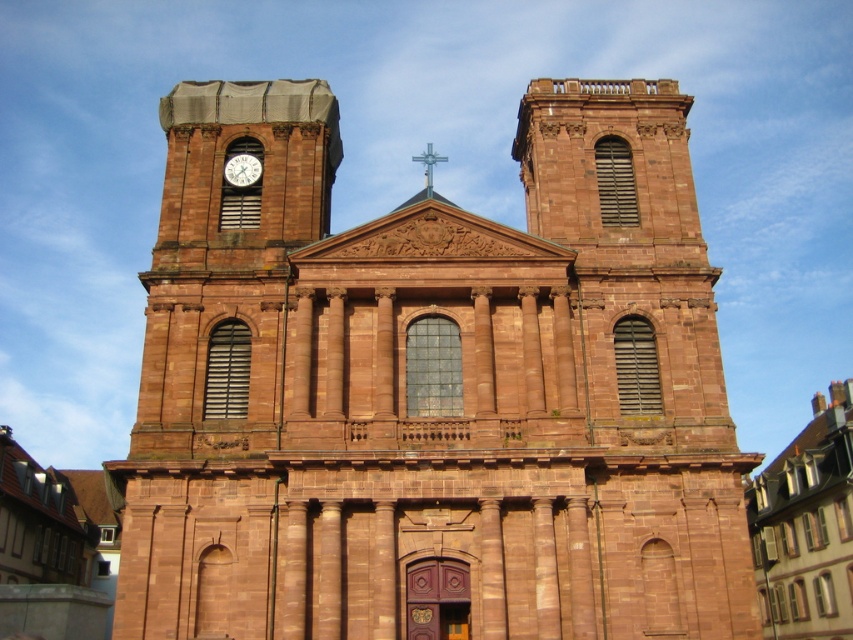
Measure the distance from brown stone church at center to white glossy clock at upper left.

A distance of 17.82 meters exists between brown stone church at center and white glossy clock at upper left.

Is brown stone church at center behind white glossy clock at upper left?

No, brown stone church at center is closer to the viewer.

You are a GUI agent. You are given a task and a screenshot of the screen. Output one action in this format:
    pyautogui.click(x=<x>, y=<y>)
    Task: Click on the brown stone church at center
    The height and width of the screenshot is (640, 853).
    Given the screenshot: What is the action you would take?
    pyautogui.click(x=432, y=388)

Who is more distant from viewer, (239, 186) or (428, 196)?

The point (239, 186) is behind.

Is white glossy clock at upper left positioned before metallic cross at upper center?

No, it is behind metallic cross at upper center.

Describe the element at coordinates (242, 170) in the screenshot. This screenshot has height=640, width=853. I see `white glossy clock at upper left` at that location.

What are the coordinates of `white glossy clock at upper left` in the screenshot? It's located at (242, 170).

Can you confirm if brown stone church at center is shorter than metallic cross at upper center?

In fact, brown stone church at center may be taller than metallic cross at upper center.

Who is shorter, brown stone church at center or metallic cross at upper center?

Standing shorter between the two is metallic cross at upper center.

Which is behind, point (448, 348) or point (428, 148)?

The point (428, 148) is more distant.

Image resolution: width=853 pixels, height=640 pixels. I want to click on brown stone church at center, so click(432, 388).